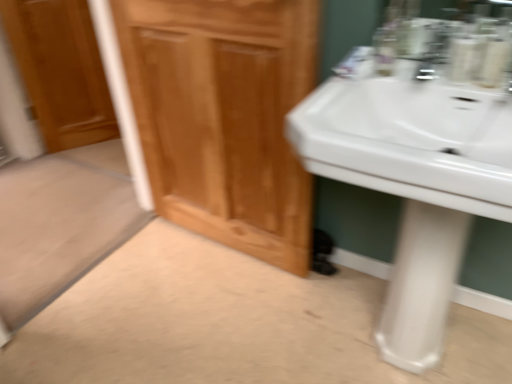
The width and height of the screenshot is (512, 384). What are the coordinates of `free space that is in between wooden cabinet at center and white glossy pedestal at lower right` in the screenshot? It's located at (307, 296).